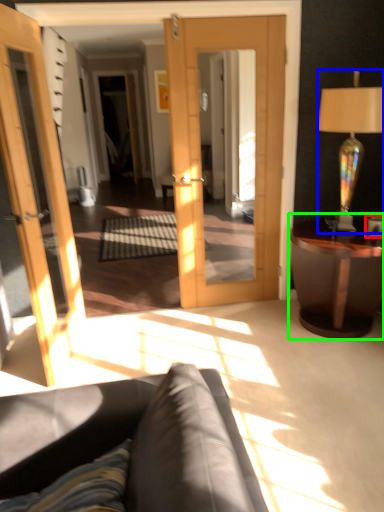
Question: Estimate the real-world distances between objects in this image. Which object is farther from coffee cup (highlighted by a red box), lamp (highlighted by a blue box) or table (highlighted by a green box)?

Choices:
 (A) lamp
 (B) table

Answer: (A)